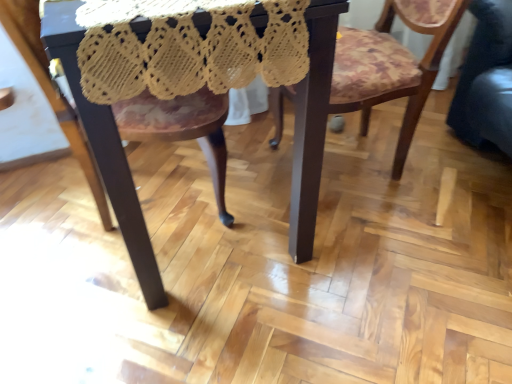
In order to click on vacant area that is situated to the right of wooden floral-patterned chair at center, the first chair viewed from the right in this screenshot , I will do `click(450, 167)`.